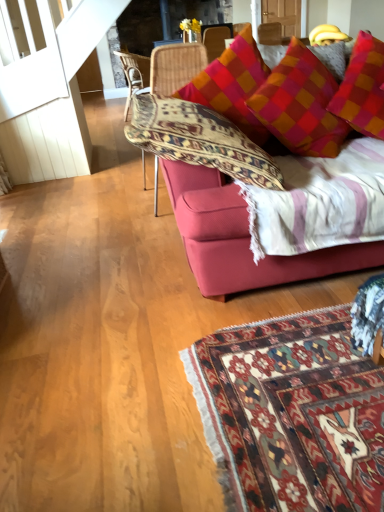
Question: From the image's perspective, is woven wicker chair at center, which appears as the 2th chair when viewed from the back, on top of woven rattan chair at center, the 2th chair ordered from the bottom?

Choices:
 (A) no
 (B) yes

Answer: (A)

Question: Can you confirm if woven wicker chair at center, which is counted as the 1th chair, starting from the right, is taller than woven rattan chair at center, the 2th chair in the right-to-left sequence?

Choices:
 (A) no
 (B) yes

Answer: (B)

Question: Can you confirm if woven wicker chair at center, which appears as the 2th chair when viewed from the top, is wider than woven rattan chair at center, the first chair when ordered from back to front?

Choices:
 (A) no
 (B) yes

Answer: (A)

Question: Can we say woven wicker chair at center, which is counted as the 2th chair, starting from the left, lies outside woven rattan chair at center, acting as the 1th chair starting from the top?

Choices:
 (A) yes
 (B) no

Answer: (A)

Question: Is woven wicker chair at center, which appears as the 2th chair when viewed from the top, further to camera compared to woven rattan chair at center, marked as the 1th chair in a left-to-right arrangement?

Choices:
 (A) no
 (B) yes

Answer: (A)

Question: Does woven wicker chair at center, the first chair positioned from the front, have a lesser height compared to woven rattan chair at center, marked as the 1th chair in a left-to-right arrangement?

Choices:
 (A) yes
 (B) no

Answer: (B)

Question: Would you consider woven wicker chair at center, which is counted as the 1th chair, starting from the right, to be distant from velvet red couch at upper right?

Choices:
 (A) no
 (B) yes

Answer: (A)

Question: From the image's perspective, does woven wicker chair at center, which appears as the 2th chair when viewed from the top, appear lower than velvet red couch at upper right?

Choices:
 (A) no
 (B) yes

Answer: (A)

Question: Is woven wicker chair at center, the first chair in the bottom-to-top sequence, smaller than velvet red couch at upper right?

Choices:
 (A) no
 (B) yes

Answer: (B)

Question: Does woven wicker chair at center, which is counted as the 2th chair, starting from the left, have a greater height compared to velvet red couch at upper right?

Choices:
 (A) yes
 (B) no

Answer: (A)

Question: Is woven wicker chair at center, which is counted as the 1th chair, starting from the right, wider than velvet red couch at upper right?

Choices:
 (A) no
 (B) yes

Answer: (A)

Question: Could you tell me if woven wicker chair at center, the first chair in the bottom-to-top sequence, is turned towards velvet red couch at upper right?

Choices:
 (A) yes
 (B) no

Answer: (B)

Question: Is woven rattan chair at center, the 2th chair viewed from the front, at the left side of woven wicker chair at center, the first chair positioned from the front?

Choices:
 (A) yes
 (B) no

Answer: (A)